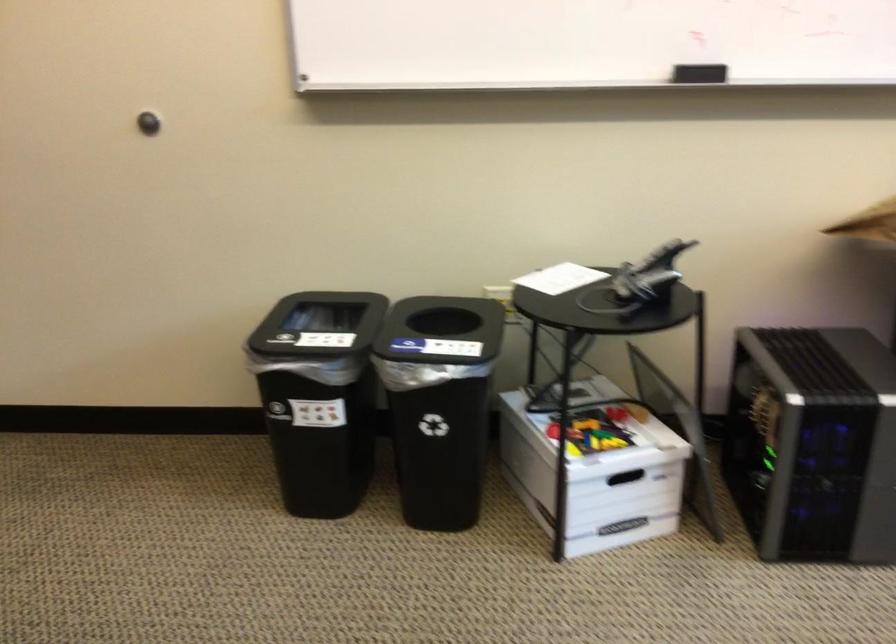
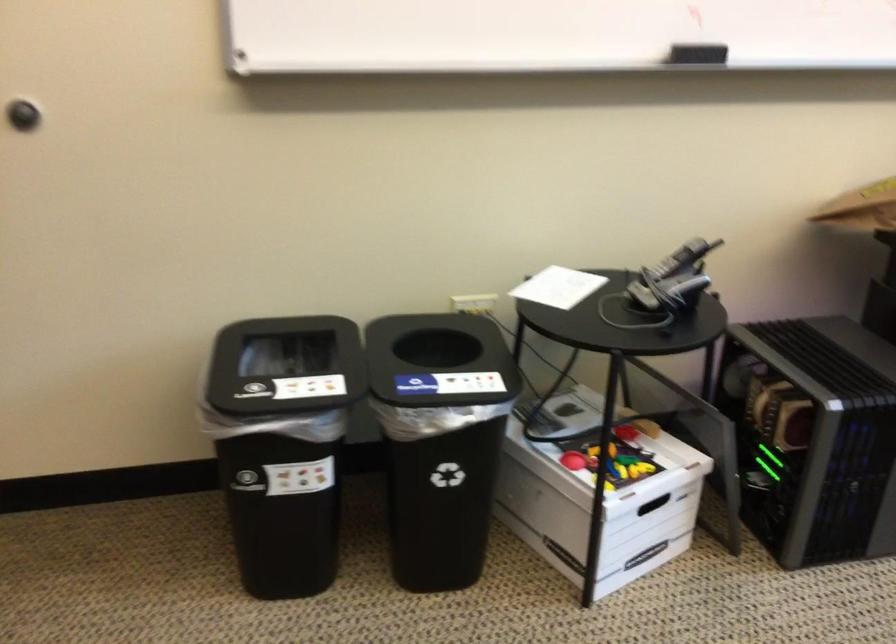
The point at (560, 279) is marked in the first image. Where is the corresponding point in the second image?

(558, 287)